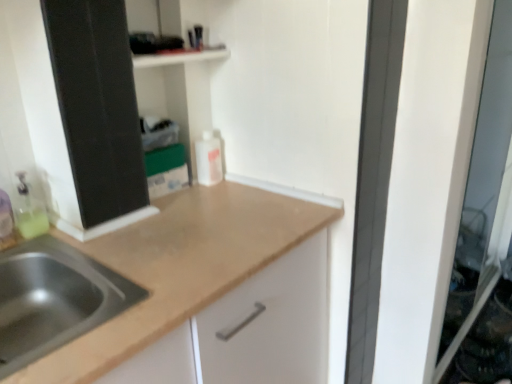
Question: Based on their sizes in the image, would you say transparent glass screen door at right is bigger or smaller than stainless steel sink at lower left?

Choices:
 (A) small
 (B) big

Answer: (B)

Question: Is transparent glass screen door at right to the left or to the right of stainless steel sink at lower left in the image?

Choices:
 (A) right
 (B) left

Answer: (A)

Question: Estimate the real-world distances between objects in this image. Which object is closer to the stainless steel sink at lower left?

Choices:
 (A) transparent glass screen door at right
 (B) translucent plastic bottle at left
 (C) white matte bottle at center

Answer: (B)

Question: Based on their relative distances, which object is nearer to the white matte bottle at center?

Choices:
 (A) translucent plastic bottle at left
 (B) transparent glass screen door at right
 (C) stainless steel sink at lower left

Answer: (A)